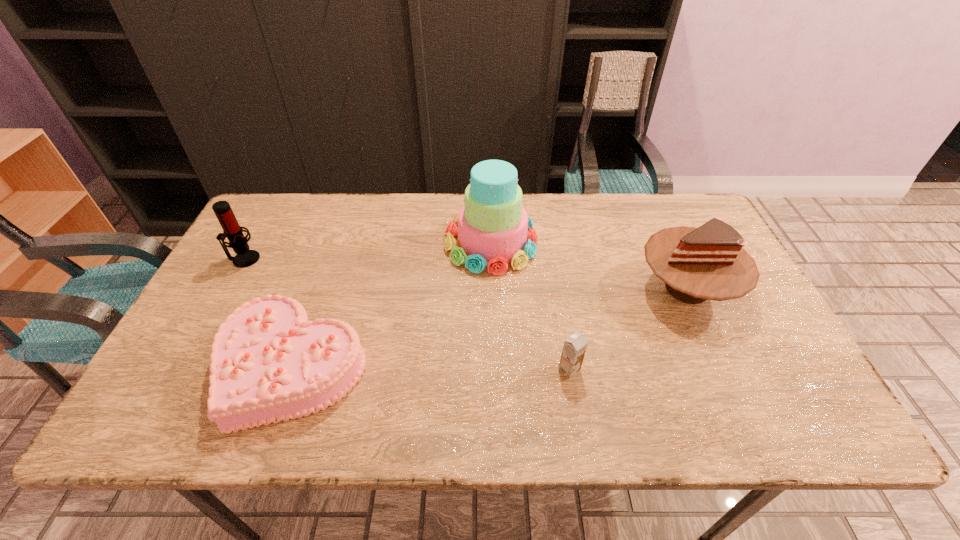
Where is `blank space at the far edge`? The height and width of the screenshot is (540, 960). blank space at the far edge is located at coordinates (424, 227).

The width and height of the screenshot is (960, 540). In the image, there is a desktop. Find the location of `vacant space at the near edge`. vacant space at the near edge is located at coordinates (736, 427).

In the image, there is a desktop. Identify the location of vacant area at the right edge. Image resolution: width=960 pixels, height=540 pixels. (731, 326).

Image resolution: width=960 pixels, height=540 pixels. Find the location of `vacant space at the far left corner`. vacant space at the far left corner is located at coordinates (256, 233).

Image resolution: width=960 pixels, height=540 pixels. What are the coordinates of `unoccupied position between the leftmost object and the second cake from right to left` in the screenshot? It's located at 368,251.

Locate an element on the screen. empty location between the leftmost object and the fourth object from left to right is located at coordinates (407, 314).

Find the location of a particular element. Image resolution: width=960 pixels, height=540 pixels. vacant region between the fourth tallest object and the leftmost object is located at coordinates (407, 314).

Image resolution: width=960 pixels, height=540 pixels. I want to click on free space between the second cake from right to left and the fourth object from right to left, so click(392, 305).

Where is `free area in between the second tallest cake and the second object from left to right`? The height and width of the screenshot is (540, 960). free area in between the second tallest cake and the second object from left to right is located at coordinates (490, 328).

Find the location of a particular element. The image size is (960, 540). free space between the rightmost object and the third object from right to left is located at coordinates (588, 265).